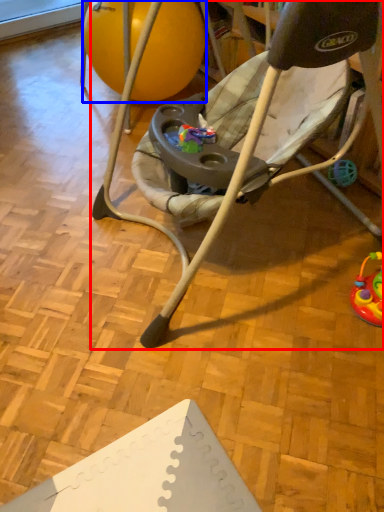
Question: Which object appears closest to the camera in this image, chair (highlighted by a red box) or ball (highlighted by a blue box)?

Choices:
 (A) chair
 (B) ball

Answer: (A)